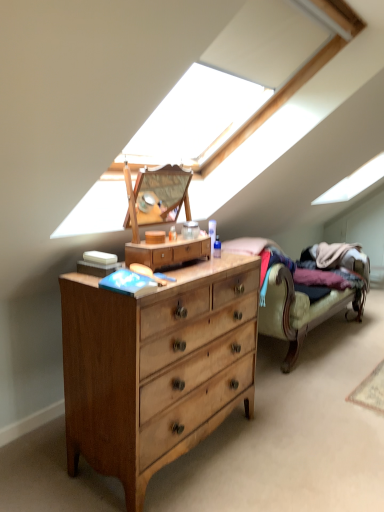
Question: In terms of size, does light wood chest of drawers at center appear bigger or smaller than light brown wood dresser at center?

Choices:
 (A) small
 (B) big

Answer: (B)

Question: In terms of width, does light wood chest of drawers at center look wider or thinner when compared to light brown wood dresser at center?

Choices:
 (A) wide
 (B) thin

Answer: (A)

Question: Based on their relative distances, which object is farther from the light brown wood dresser at center?

Choices:
 (A) velvet beige couch at right
 (B) light wood chest of drawers at center

Answer: (A)

Question: Which of these objects is positioned farthest from the velvet beige couch at right?

Choices:
 (A) light brown wood dresser at center
 (B) light wood chest of drawers at center

Answer: (A)